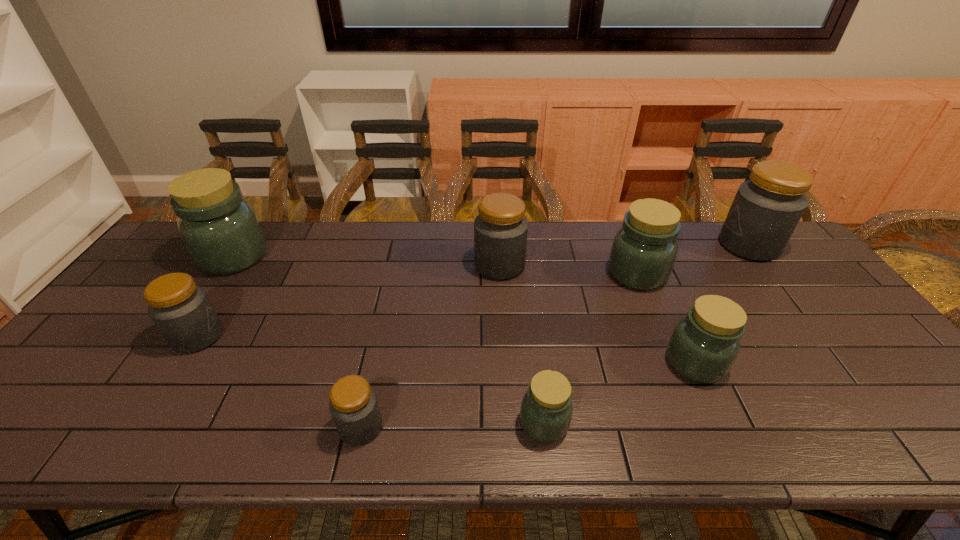
At what (x,y) coordinates should I click in order to perform the action: click on the nearest green jar. Please return your answer as a coordinate pair (x, y). This screenshot has width=960, height=540. Looking at the image, I should click on (546, 410).

Identify the location of the second green jar from left to right. This screenshot has height=540, width=960. [546, 410].

In order to click on vacant space situated 0.400m on the surface of the biggest gray jar near the warning symbol in this screenshot , I will do `click(598, 245)`.

Find the location of `free location located 0.150m on the surface of the biggest gray jar near the warning symbol`. free location located 0.150m on the surface of the biggest gray jar near the warning symbol is located at coordinates (674, 245).

At what (x,y) coordinates should I click in order to perform the action: click on blank space located on the surface of the biggest gray jar near the warning symbol. Please return your answer as a coordinate pair (x, y). Image resolution: width=960 pixels, height=540 pixels. Looking at the image, I should click on [x=702, y=245].

Find the location of a particular element. This screenshot has height=540, width=960. vacant space located 0.200m on the right of the leftmost green jar is located at coordinates (331, 256).

This screenshot has height=540, width=960. I want to click on free space located on the surface of the second biggest gray jar near the warning symbol, so click(420, 265).

In order to click on vacant region located 0.110m on the surface of the second biggest gray jar near the warning symbol in this screenshot , I will do `click(439, 265)`.

Locate an element on the screen. This screenshot has height=540, width=960. vacant space located on the surface of the second biggest gray jar near the warning symbol is located at coordinates (426, 265).

Identify the location of free space located 0.080m on the left of the third smallest green jar. The image size is (960, 540). (581, 274).